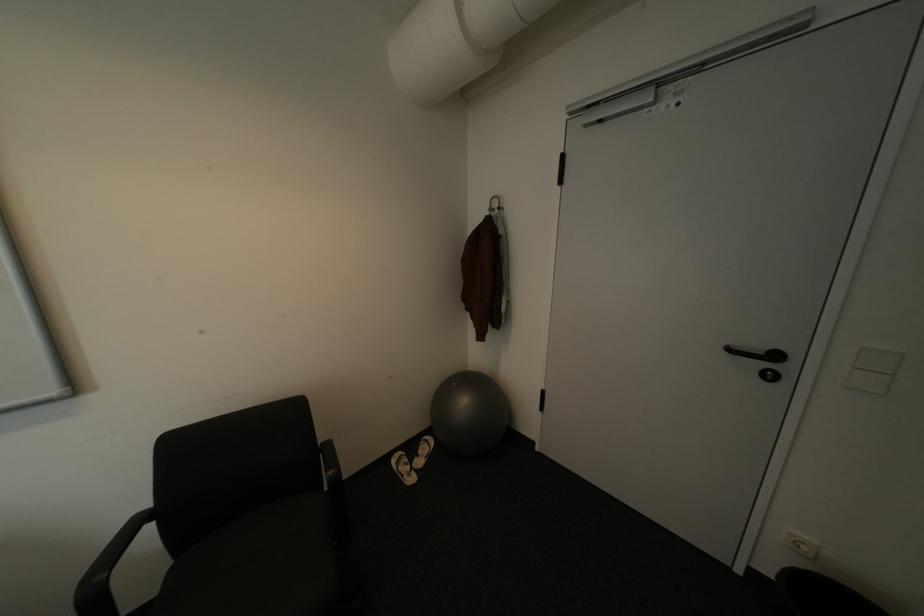
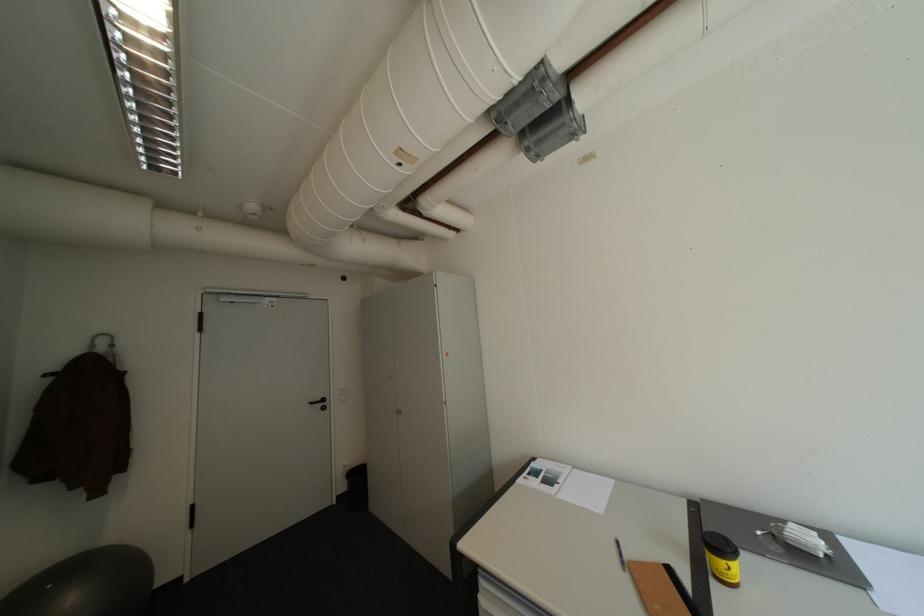
In the second image, find the point that corresponds to point 766,567 in the first image.

(347, 493)